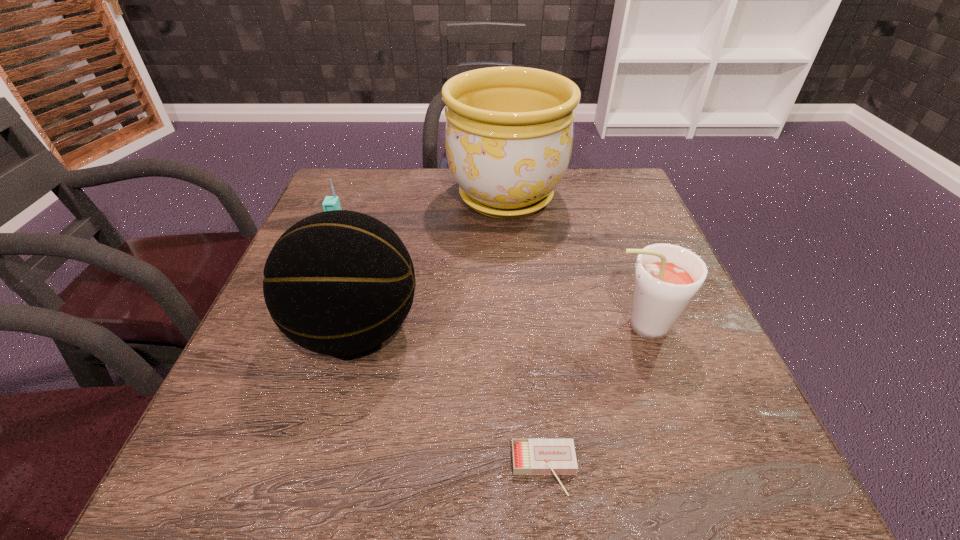
Image resolution: width=960 pixels, height=540 pixels. I want to click on vacant area that lies between the nearest object and the rightmost object, so pyautogui.click(x=592, y=398).

The height and width of the screenshot is (540, 960). Identify the location of free space between the flowerpot and the cellular telephone. (422, 217).

Locate an element on the screen. The width and height of the screenshot is (960, 540). vacant area that lies between the rightmost object and the shortest object is located at coordinates (592, 398).

Identify the location of object that stands as the closest to the basketball. The width and height of the screenshot is (960, 540). (330, 203).

Identify the location of the closest object to the basketball. (330, 203).

I want to click on vacant area in the image that satisfies the following two spatial constraints: 1. on the keypad of the basketball; 2. on the right side of the cellular telephone, so point(301,330).